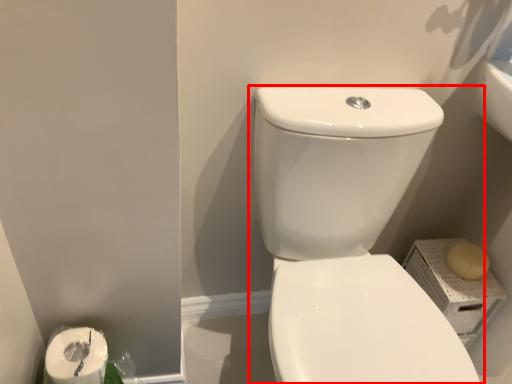
Question: Considering the relative positions of toilet (annotated by the red box) and soap in the image provided, where is toilet (annotated by the red box) located with respect to the staircase?

Choices:
 (A) right
 (B) left

Answer: (B)